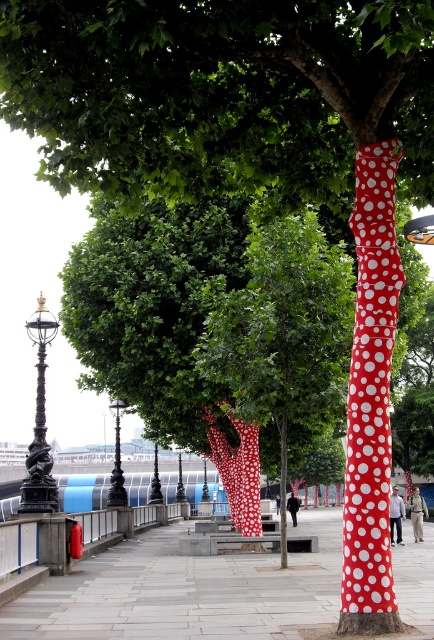
You are a pedestrian standing on the smooth concrete pavement at center. You want to touch the red dotted fabric at center. Which direction should you move to reach it?

The red dotted fabric at center is to the left of the smooth concrete pavement at center, so you should move to the left to reach it.

You are a city planner evaluating the safety of the walkway. Considering the smooth concrete pavement at center and the red dotted fabric at center, which one is lower to the ground and might pose a tripping hazard?

The smooth concrete pavement at center is shorter than the red dotted fabric at center, so the pavement is lower to the ground. However, the red dotted fabric at center being higher could potentially create a tripping hazard where it meets the pavement.

You are a photographer standing at the center of the walkway. You want to capture both the red dotted fabric at center and the red dotted pole at right in a single shot. Which object should you position closer to the left side of your camera frame?

The red dotted fabric at center should be positioned closer to the left side of your camera frame because it is located to the left of the red dotted pole at right in the scene.